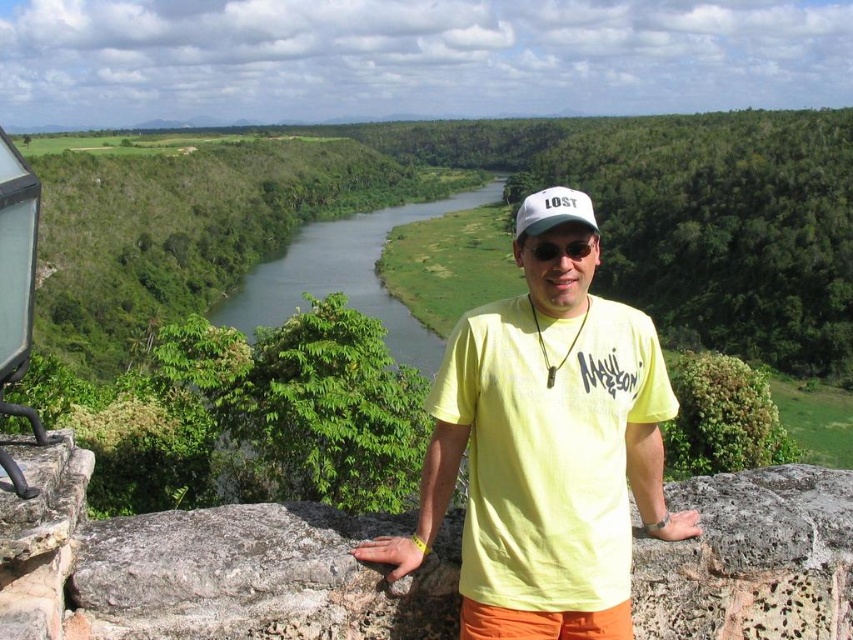
Between yellow cotton t-shirt at center and white fabric baseball cap at center, which one is positioned lower?

yellow cotton t-shirt at center is lower down.

How distant is yellow cotton t-shirt at center from white fabric baseball cap at center?

They are 3.49 meters apart.

Is point (543, 339) more distant than point (544, 221)?

Yes, it is behind point (544, 221).

Find the location of a particular element. yellow cotton t-shirt at center is located at coordinates (546, 452).

In the scene shown: Is green smooth river at center shorter than white fabric baseball cap at center?

No.

Is green smooth river at center further to camera compared to white fabric baseball cap at center?

That is True.

Find the location of `green smooth river at center`. green smooth river at center is located at coordinates (347, 275).

Identify the location of green smooth river at center. (347, 275).

Who is shorter, yellow cotton t-shirt at center or green smooth river at center?

With less height is yellow cotton t-shirt at center.

How distant is yellow cotton t-shirt at center from green smooth river at center?

They are 218.90 meters apart.

This screenshot has height=640, width=853. What do you see at coordinates (546, 452) in the screenshot?
I see `yellow cotton t-shirt at center` at bounding box center [546, 452].

This screenshot has width=853, height=640. Identify the location of yellow cotton t-shirt at center. (546, 452).